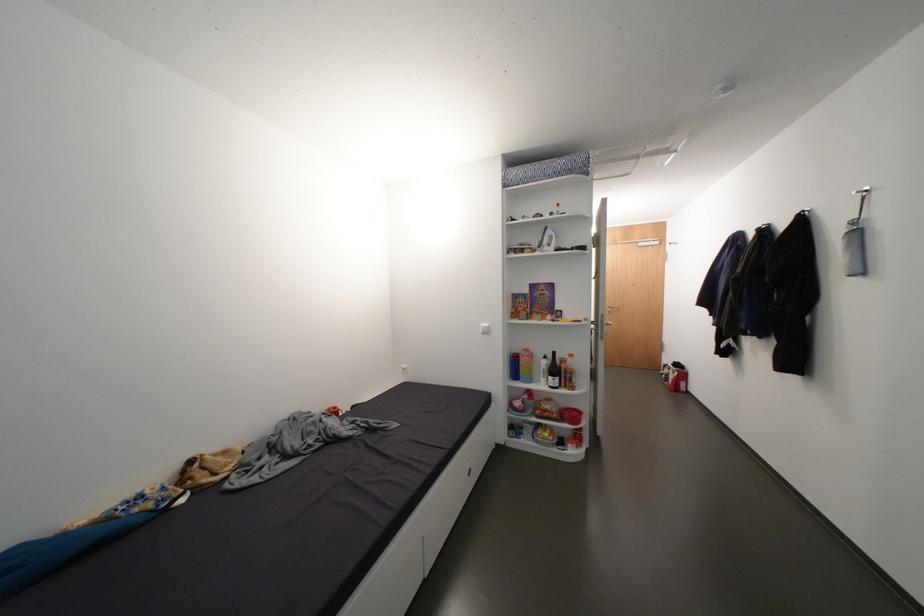
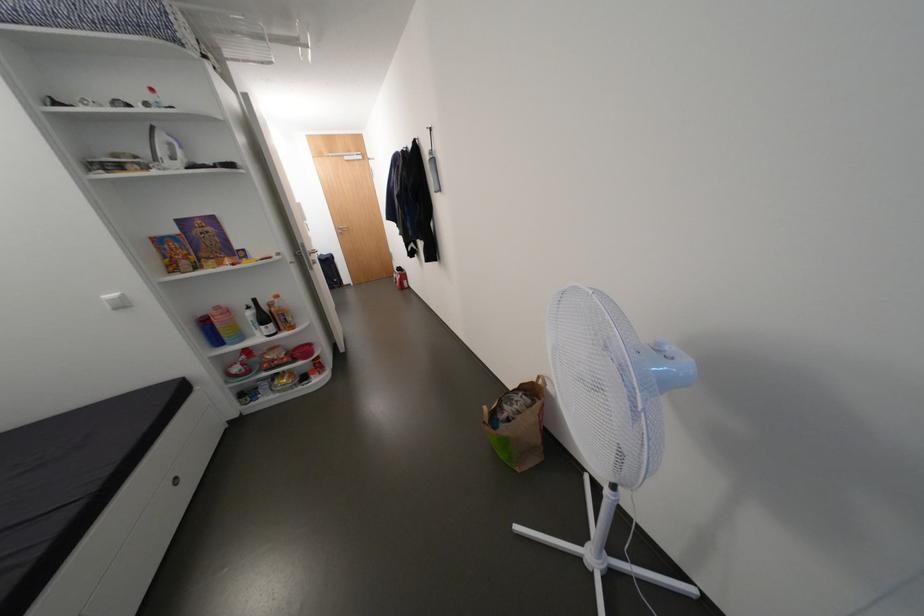
In the second image, find the point that corresponds to [553,363] in the first image.

(258, 315)